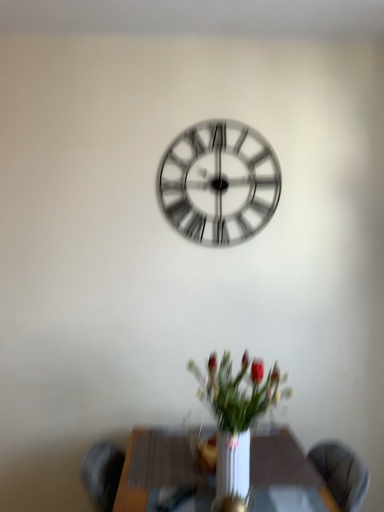
In order to click on wooden table at center in this screenshot , I will do `click(157, 469)`.

At what (x,y) coordinates should I click in order to perform the action: click on white glossy vase at center. Please return your answer as a coordinate pair (x, y). Looking at the image, I should click on (236, 419).

Is the depth of metallic silver clock at center less than that of wooden table at center?

No, metallic silver clock at center is further to the viewer.

Is point (205, 138) closer to camera compared to point (179, 465)?

No, it is not.

From a real-world perspective, is metallic silver clock at center above or below wooden table at center?

metallic silver clock at center is above wooden table at center.

Are metallic silver clock at center and wooden table at center far apart?

metallic silver clock at center is far away from wooden table at center.

Between white glossy vase at center and wooden table at center, which one appears on the right side from the viewer's perspective?

Positioned to the right is white glossy vase at center.

Considering the sizes of objects white glossy vase at center and wooden table at center in the image provided, who is smaller, white glossy vase at center or wooden table at center?

white glossy vase at center.

From a real-world perspective, between white glossy vase at center and wooden table at center, who is vertically lower?

From a 3D spatial view, wooden table at center is below.

Is metallic silver clock at center oriented towards white glossy vase at center?

No, metallic silver clock at center is not aimed at white glossy vase at center.

Is there a large distance between metallic silver clock at center and white glossy vase at center?

No, metallic silver clock at center is in close proximity to white glossy vase at center.

At what (x,y) coordinates should I click in order to perform the action: click on floral arrangement that is in front of the metallic silver clock at center. Please return your answer as a coordinate pair (x, y). Looking at the image, I should click on (236, 419).

How many degrees apart are the facing directions of metallic silver clock at center and white glossy vase at center?

The facing directions of metallic silver clock at center and white glossy vase at center are 1.56 degrees apart.

Is white glossy vase at center facing towards metallic silver clock at center?

No, white glossy vase at center does not turn towards metallic silver clock at center.

In the scene shown: Considering the sizes of objects white glossy vase at center and metallic silver clock at center in the image provided, who is wider, white glossy vase at center or metallic silver clock at center?

Wider between the two is white glossy vase at center.

Is white glossy vase at center at the right side of metallic silver clock at center?

Yes, white glossy vase at center is to the right of metallic silver clock at center.

Considering the positions of objects white glossy vase at center and metallic silver clock at center in the image provided, who is in front, white glossy vase at center or metallic silver clock at center?

white glossy vase at center is in front.

From a real-world perspective, between wooden table at center and metallic silver clock at center, who is vertically higher?

metallic silver clock at center is physically above.

Which is less distant, [159,469] or [179,208]?

Point [159,469] appears to be closer to the viewer than point [179,208].

Looking at this image, looking at their sizes, would you say wooden table at center is wider or thinner than metallic silver clock at center?

In the image, wooden table at center appears to be wider than metallic silver clock at center.

Image resolution: width=384 pixels, height=512 pixels. In order to click on floral arrangement on the right of wooden table at center in this screenshot , I will do `click(236, 419)`.

Is white glossy vase at center at the back of wooden table at center?

No, wooden table at center is not facing away from white glossy vase at center.

Who is bigger, wooden table at center or white glossy vase at center?

wooden table at center.

Do you think wooden table at center is within white glossy vase at center, or outside of it?

wooden table at center lies outside white glossy vase at center.

The image size is (384, 512). What are the coordinates of `wall clock lying behind the wooden table at center` in the screenshot? It's located at (219, 183).

Locate an element on the screen. This screenshot has width=384, height=512. floral arrangement above the wooden table at center (from a real-world perspective) is located at coordinates (236, 419).

Based on their spatial positions, is white glossy vase at center or wooden table at center further from metallic silver clock at center?

wooden table at center is positioned further to the anchor metallic silver clock at center.

Considering their positions, is white glossy vase at center positioned further to wooden table at center than metallic silver clock at center?

Among the two, metallic silver clock at center is located further to wooden table at center.

Consider the image. Based on their spatial positions, is metallic silver clock at center or wooden table at center further from white glossy vase at center?

The object further to white glossy vase at center is metallic silver clock at center.

When comparing their distances from wooden table at center, does metallic silver clock at center or white glossy vase at center seem closer?

Among the two, white glossy vase at center is located nearer to wooden table at center.

Looking at the image, which one is located closer to metallic silver clock at center, wooden table at center or white glossy vase at center?

Among the two, white glossy vase at center is located nearer to metallic silver clock at center.

From the image, which object appears to be nearer to white glossy vase at center, wooden table at center or metallic silver clock at center?

Based on the image, wooden table at center appears to be nearer to white glossy vase at center.

At what (x,y) coordinates should I click in order to perform the action: click on floral arrangement between metallic silver clock at center and wooden table at center in the vertical direction. Please return your answer as a coordinate pair (x, y). Looking at the image, I should click on (236, 419).